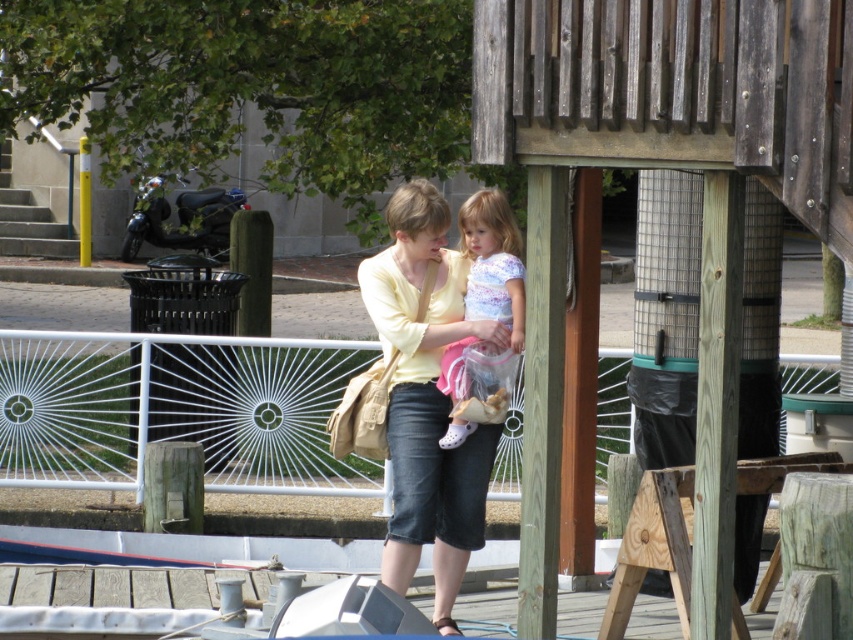
Which of these two, matte yellow sweater at center or pastel floral dress at center, stands taller?

matte yellow sweater at center

Who is positioned more to the left, matte yellow sweater at center or pastel floral dress at center?

Positioned to the left is matte yellow sweater at center.

Image resolution: width=853 pixels, height=640 pixels. In order to click on matte yellow sweater at center in this screenshot , I will do `click(427, 397)`.

The image size is (853, 640). Identify the location of matte yellow sweater at center. (427, 397).